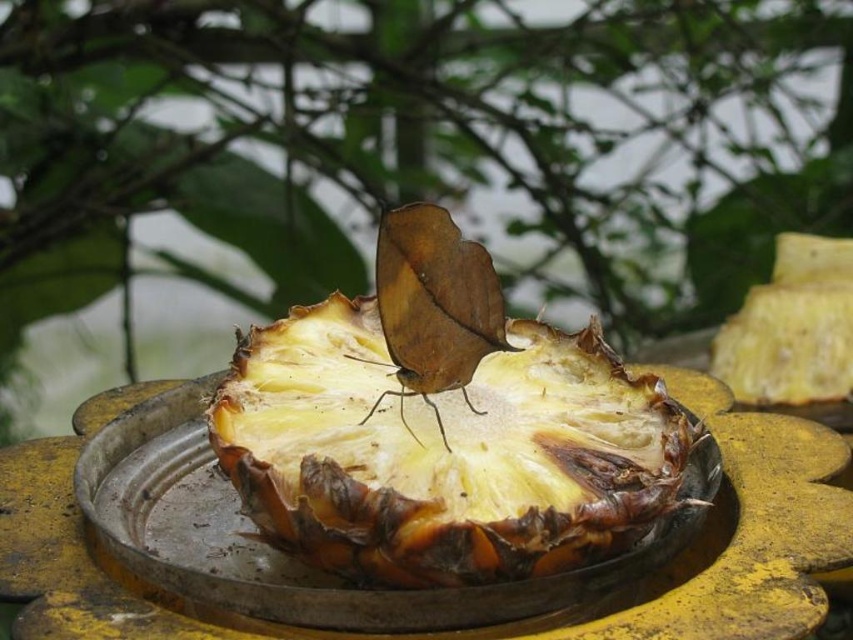
Question: Does yellow matte pineapple at center appear under brown matte butterfly at center?

Choices:
 (A) yes
 (B) no

Answer: (A)

Question: Is yellow matte pineapple at center to the left of brown matte butterfly at center from the viewer's perspective?

Choices:
 (A) no
 (B) yes

Answer: (A)

Question: Which of the following is the farthest from the observer?

Choices:
 (A) (463, 268)
 (B) (469, 536)

Answer: (A)

Question: Does yellow matte pineapple at center appear on the left side of brown matte butterfly at center?

Choices:
 (A) yes
 (B) no

Answer: (B)